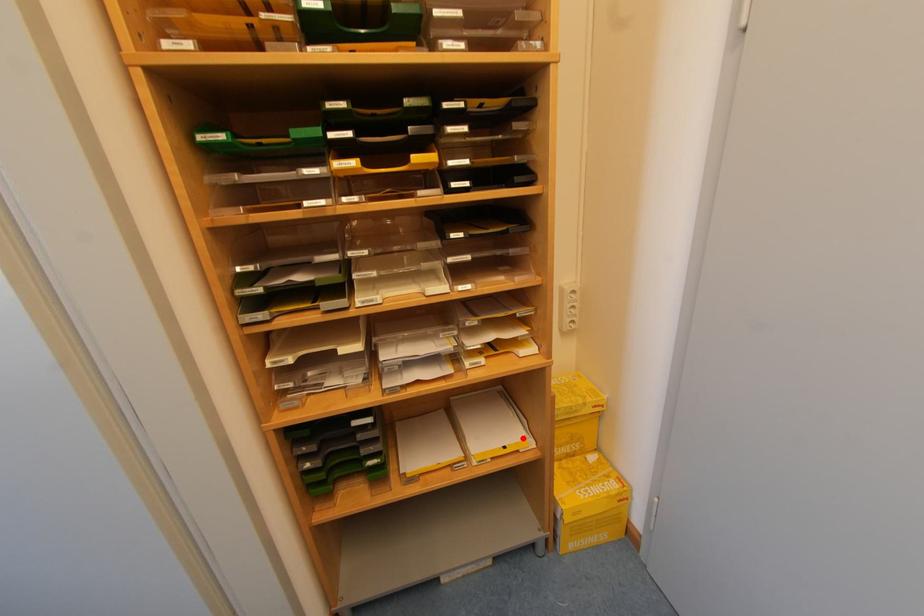
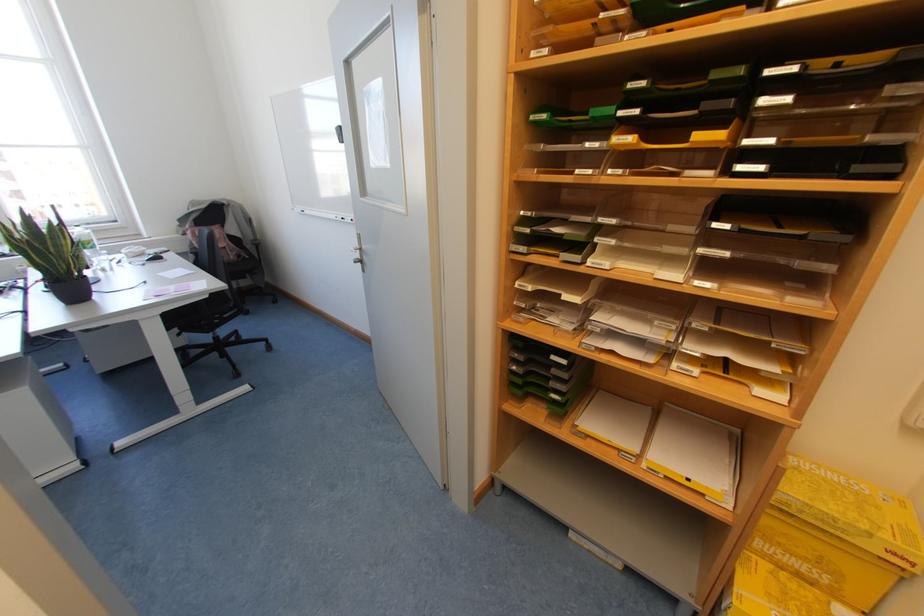
In the second image, find the point that corresponds to the highlighted location in the first image.

(720, 490)